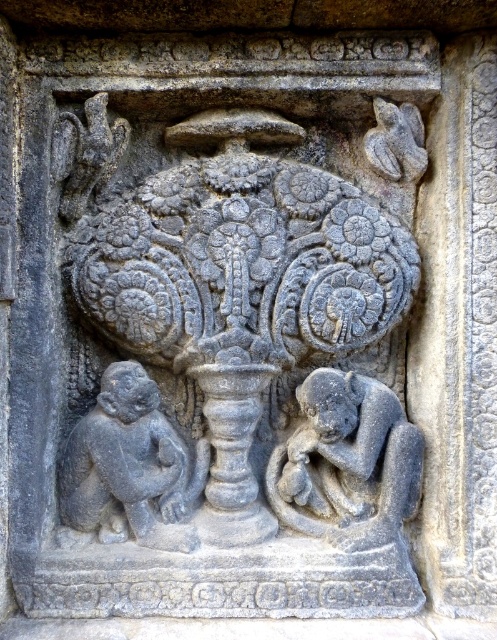
Between point (254, 228) and point (132, 374), which one is positioned in front?

Point (132, 374) is more forward.

Is the position of gray stone vase at center more distant than that of gray stone monkey at lower left?

Yes, gray stone vase at center is behind gray stone monkey at lower left.

Who is more forward, (394, 131) or (178, 529)?

Point (178, 529) is more forward.

The height and width of the screenshot is (640, 497). In order to click on gray stone vase at center in this screenshot , I will do `click(251, 328)`.

Based on the photo, does gray stone vase at center appear over gray stone monkey at lower right?

Correct, gray stone vase at center is located above gray stone monkey at lower right.

Who is lower down, gray stone vase at center or gray stone monkey at lower right?

gray stone monkey at lower right is lower down.

The image size is (497, 640). I want to click on gray stone vase at center, so tap(251, 328).

Locate an element on the screen. gray stone vase at center is located at coordinates (251, 328).

Is gray stone monkey at lower right taller than gray stone monkey at lower left?

No.

Is point (364, 426) positioned in front of point (101, 448)?

No, (364, 426) is behind (101, 448).

The width and height of the screenshot is (497, 640). What are the coordinates of `gray stone monkey at lower right` in the screenshot? It's located at (346, 461).